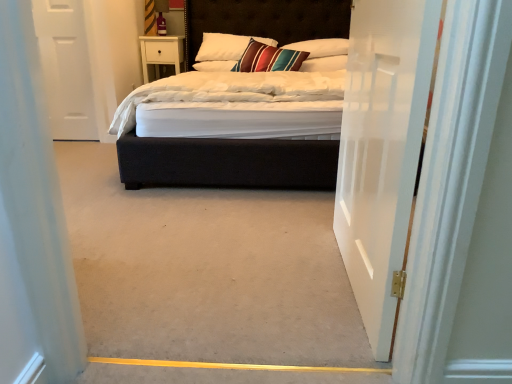
This screenshot has width=512, height=384. Find the location of `vacant region to the left of white glossy door at center, which is the 2th door from left to right`. vacant region to the left of white glossy door at center, which is the 2th door from left to right is located at coordinates (223, 293).